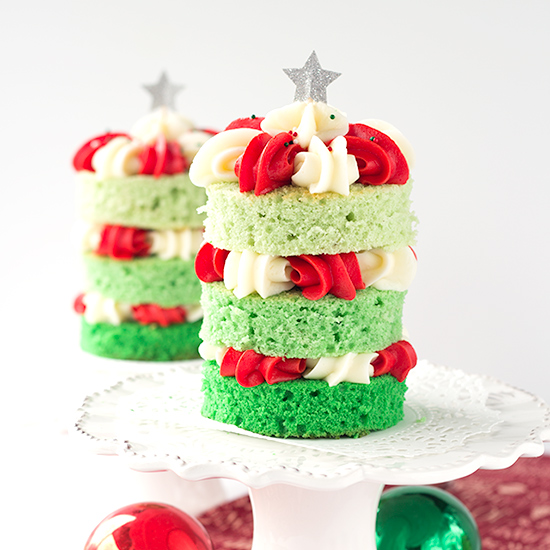
Locate an element on the screen. doiley is located at coordinates (304, 454).